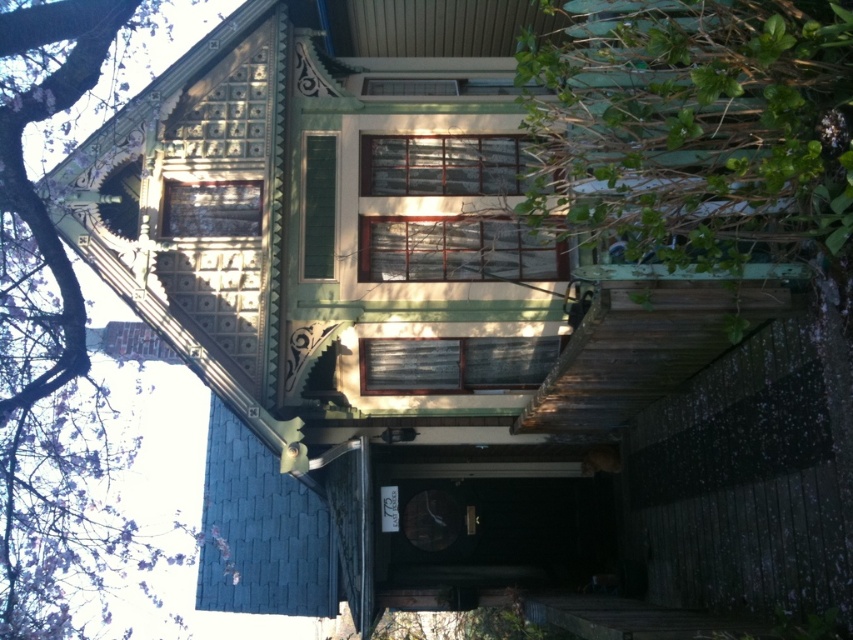
Does green leafy bush at right appear over purple leafy tree at upper left?

Actually, green leafy bush at right is below purple leafy tree at upper left.

Does green leafy bush at right appear on the left side of purple leafy tree at upper left?

Incorrect, green leafy bush at right is not on the left side of purple leafy tree at upper left.

The image size is (853, 640). Describe the element at coordinates (695, 125) in the screenshot. I see `green leafy bush at right` at that location.

Locate an element on the screen. Image resolution: width=853 pixels, height=640 pixels. green leafy bush at right is located at coordinates (695, 125).